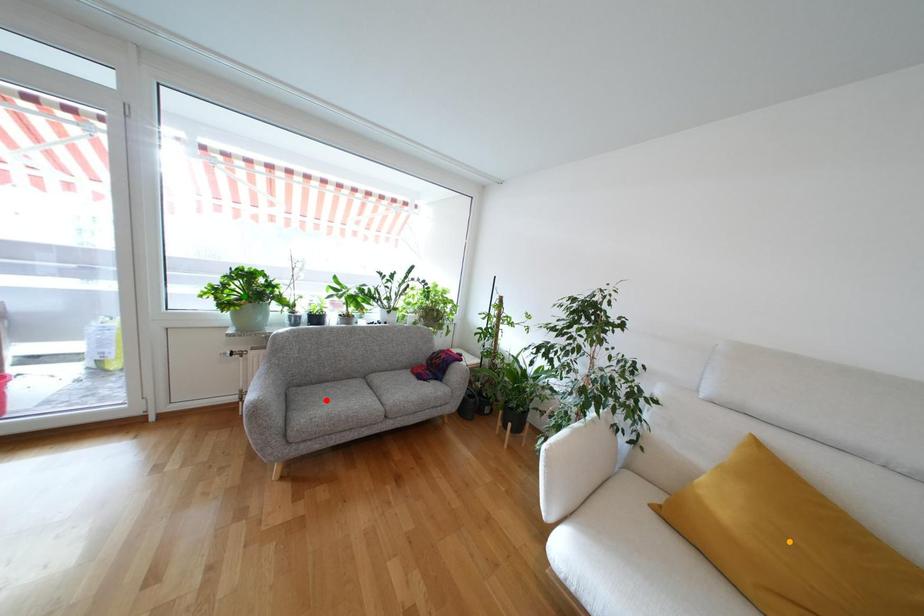
Order these from nearest to farthest:
orange point, green point, red point

1. orange point
2. green point
3. red point